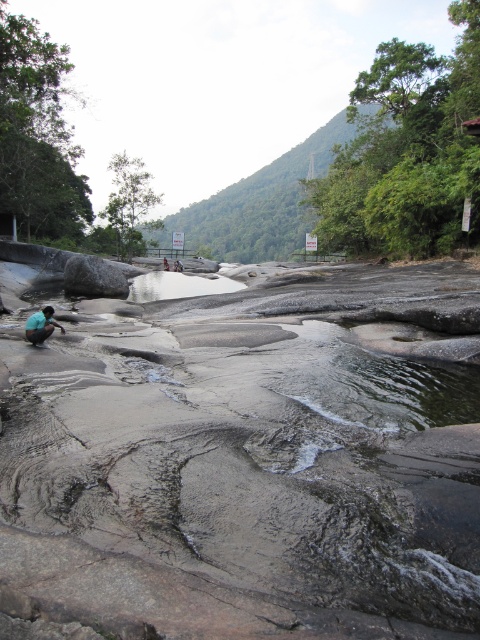
Image resolution: width=480 pixels, height=640 pixels. Describe the element at coordinates (178, 285) in the screenshot. I see `clear glass puddle at center` at that location.

Can you confirm if clear glass puddle at center is smaller than teal fabric squat at lower left?

Incorrect, clear glass puddle at center is not smaller in size than teal fabric squat at lower left.

Who is more distant from viewer, (x=151, y=276) or (x=28, y=336)?

Point (x=151, y=276)

Where is `clear glass puddle at center`? The width and height of the screenshot is (480, 640). clear glass puddle at center is located at coordinates (178, 285).

Is smooth brown mud at center below teal fabric squat at lower left?

No, smooth brown mud at center is not below teal fabric squat at lower left.

Who is shorter, smooth brown mud at center or teal fabric squat at lower left?

With less height is teal fabric squat at lower left.

Identify the location of smooth brown mud at center. pos(249,464).

Is smooth brown mud at center below gray rough rock at center?

Yes.

Between point (146, 461) and point (120, 284), which one is positioned in front?

Point (146, 461) is more forward.

Locate an element on the screen. The width and height of the screenshot is (480, 640). smooth brown mud at center is located at coordinates (249, 464).

Locate an element on the screen. This screenshot has width=480, height=640. smooth brown mud at center is located at coordinates (249, 464).